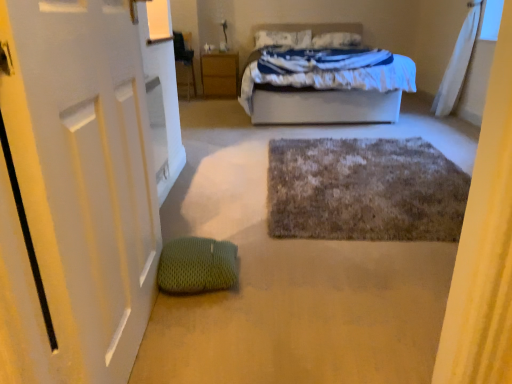
The width and height of the screenshot is (512, 384). I want to click on vacant area that lies between green textured bean bag at lower left and fuzzy gray bath mat at center, so click(x=281, y=240).